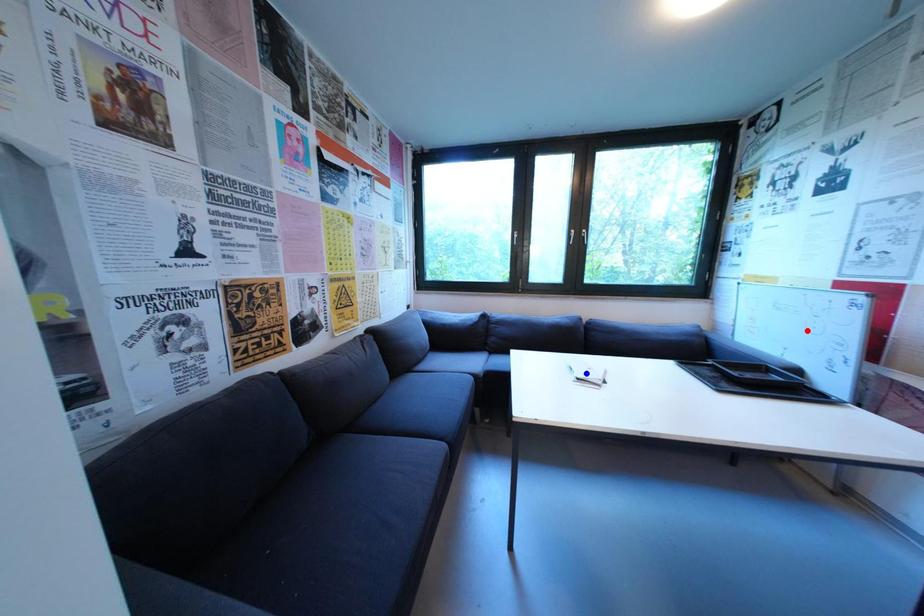
Question: Which of the two points in the image is closer to the camera?

Choices:
 (A) Blue point is closer.
 (B) Red point is closer.

Answer: (B)